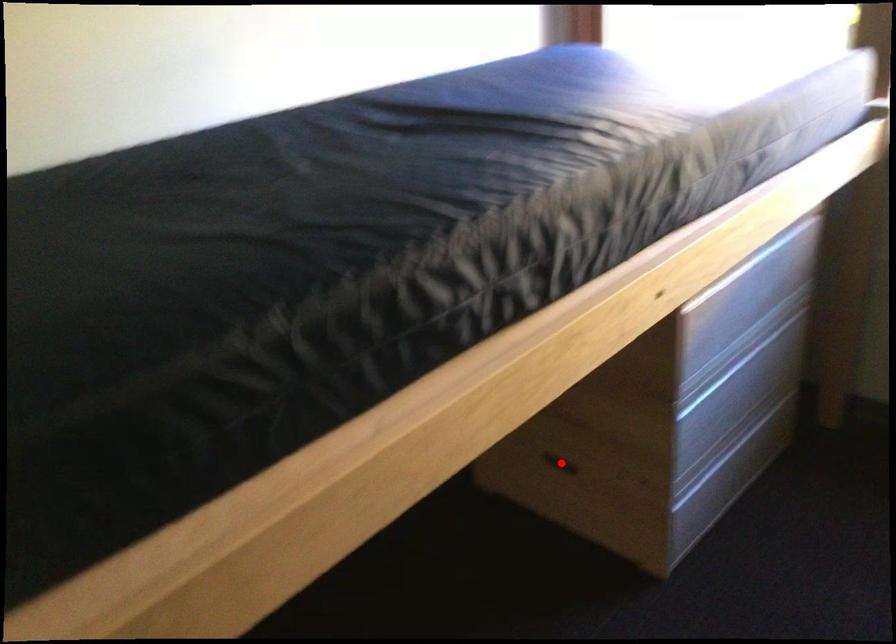
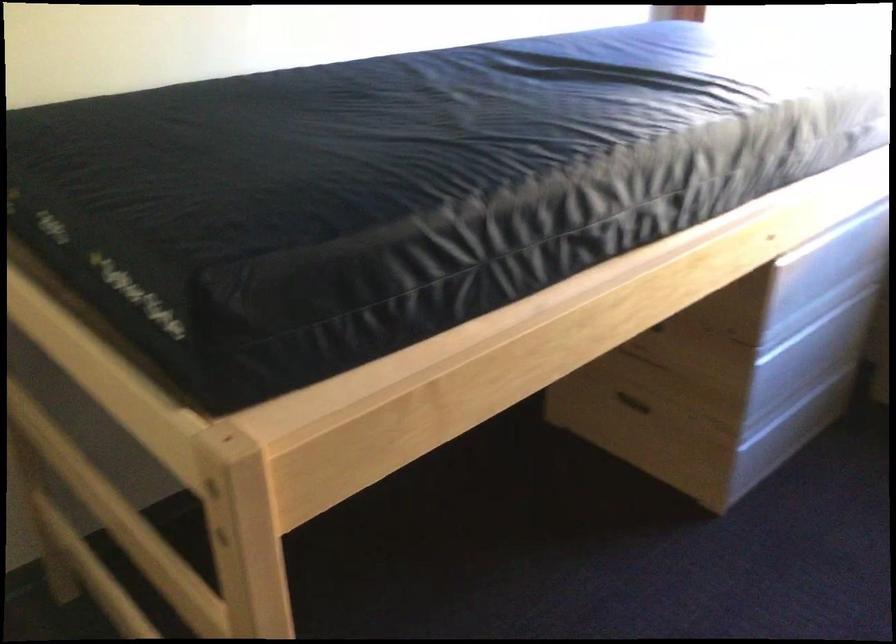
Question: I am providing you with two images of the same scene from different viewpoints. A red point is marked on the first image. Is the red point's position out of view in image 2?

Choices:
 (A) Yes
 (B) No

Answer: (B)